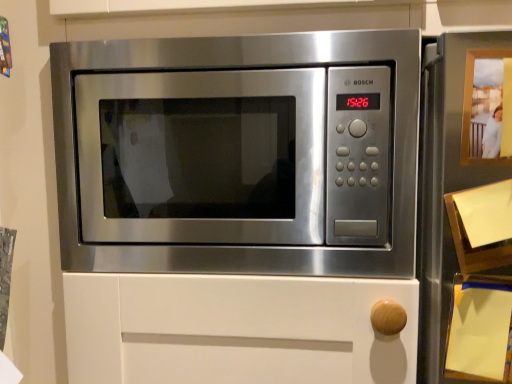
At what (x,y) coordinates should I click in order to perform the action: click on matte wood photo frame at upper right. Please return your answer as a coordinate pair (x, y). Looking at the image, I should click on (487, 108).

The height and width of the screenshot is (384, 512). Describe the element at coordinates (487, 108) in the screenshot. I see `matte wood photo frame at upper right` at that location.

In order to face matte wood photo frame at upper right, should I rotate leftwards or rightwards?

You should rotate right by 31.612 degrees.

This screenshot has width=512, height=384. Find the location of `stainless steel microwave at center`. stainless steel microwave at center is located at coordinates (239, 154).

Describe the element at coordinates (239, 154) in the screenshot. This screenshot has height=384, width=512. I see `stainless steel microwave at center` at that location.

This screenshot has height=384, width=512. Find the location of `matte wood photo frame at upper right`. matte wood photo frame at upper right is located at coordinates (487, 108).

Between stainless steel microwave at center and matte wood photo frame at upper right, which one appears on the right side from the viewer's perspective?

Positioned to the right is matte wood photo frame at upper right.

In the scene shown: Considering the positions of objects stainless steel microwave at center and matte wood photo frame at upper right in the image provided, who is behind, stainless steel microwave at center or matte wood photo frame at upper right?

Positioned behind is stainless steel microwave at center.

Which is further, (220, 110) or (465, 124)?

The point (220, 110) is farther.

From the image's perspective, which one is positioned lower, stainless steel microwave at center or matte wood photo frame at upper right?

stainless steel microwave at center appears lower in the image.

From a real-world perspective, who is located higher, stainless steel microwave at center or matte wood photo frame at upper right?

matte wood photo frame at upper right.

Between stainless steel microwave at center and matte wood photo frame at upper right, which one has larger width?

stainless steel microwave at center is wider.

Which of these two, stainless steel microwave at center or matte wood photo frame at upper right, stands shorter?

matte wood photo frame at upper right.

Between stainless steel microwave at center and matte wood photo frame at upper right, which one has larger size?

Bigger between the two is stainless steel microwave at center.

Looking at this image, do you think stainless steel microwave at center is within matte wood photo frame at upper right, or outside of it?

stainless steel microwave at center is not inside matte wood photo frame at upper right, it's outside.

Is stainless steel microwave at center placed right next to matte wood photo frame at upper right?

No, stainless steel microwave at center is not in contact with matte wood photo frame at upper right.

Is stainless steel microwave at center facing away from matte wood photo frame at upper right?

No, stainless steel microwave at center is not facing the opposite direction of matte wood photo frame at upper right.

The height and width of the screenshot is (384, 512). In order to click on microwave oven that appears below the matte wood photo frame at upper right (from the image's perspective) in this screenshot , I will do click(239, 154).

Considering the relative positions of matte wood photo frame at upper right and stainless steel microwave at center in the image provided, is matte wood photo frame at upper right to the left or to the right of stainless steel microwave at center?

Clearly, matte wood photo frame at upper right is on the right of stainless steel microwave at center in the image.

Is the position of matte wood photo frame at upper right less distant than that of stainless steel microwave at center?

Yes, matte wood photo frame at upper right is closer to the camera.

Considering the points (497, 147) and (382, 267), which point is in front, point (497, 147) or point (382, 267)?

Point (497, 147)

From the image's perspective, is matte wood photo frame at upper right positioned above or below stainless steel microwave at center?

Based on their image positions, matte wood photo frame at upper right is located above stainless steel microwave at center.

From a real-world perspective, is matte wood photo frame at upper right on top of stainless steel microwave at center?

Yes, from a real-world perspective, matte wood photo frame at upper right is above stainless steel microwave at center.

Which of these two, matte wood photo frame at upper right or stainless steel microwave at center, is wider?

Wider between the two is stainless steel microwave at center.

Who is taller, matte wood photo frame at upper right or stainless steel microwave at center?

With more height is stainless steel microwave at center.

Between matte wood photo frame at upper right and stainless steel microwave at center, which one has smaller size?

With smaller size is matte wood photo frame at upper right.

Is matte wood photo frame at upper right outside of stainless steel microwave at center?

Yes, matte wood photo frame at upper right is outside of stainless steel microwave at center.

Are matte wood photo frame at upper right and stainless steel microwave at center located far from each other?

They are positioned close to each other.

Could you tell me if matte wood photo frame at upper right is facing stainless steel microwave at center?

No, matte wood photo frame at upper right is not aimed at stainless steel microwave at center.

How many degrees apart are the facing directions of matte wood photo frame at upper right and stainless steel microwave at center?

There is a 4.03-degree angle between the facing directions of matte wood photo frame at upper right and stainless steel microwave at center.

You are a GUI agent. You are given a task and a screenshot of the screen. Output one action in this format:
    pyautogui.click(x=<x>, y=<y>)
    Task: Click on the button in front of the stainless steel microwave at center
    The image size is (512, 384).
    Given the screenshot: What is the action you would take?
    pyautogui.click(x=487, y=108)

You are a GUI agent. You are given a task and a screenshot of the screen. Output one action in this format:
    pyautogui.click(x=<x>, y=<y>)
    Task: Click on the button above the stainless steel microwave at center (from a real-world perspective)
    
    Given the screenshot: What is the action you would take?
    pyautogui.click(x=487, y=108)

Where is `button that appears on the right of stainless steel microwave at center`? button that appears on the right of stainless steel microwave at center is located at coordinates (487, 108).